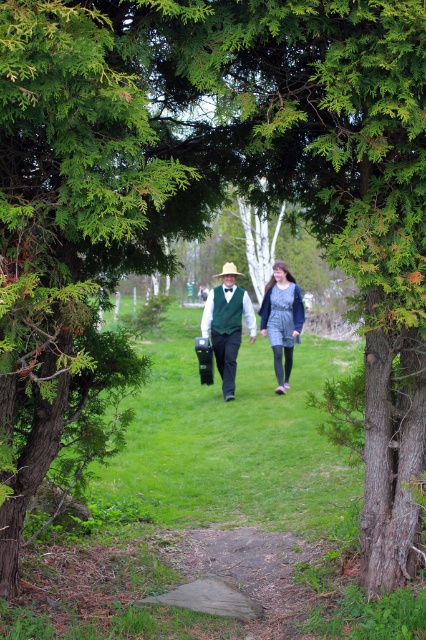
Does green textured tree at center have a lesser width compared to denim dress at center?

In fact, green textured tree at center might be wider than denim dress at center.

Is point (83, 154) more distant than point (270, 310)?

No, it is in front of (270, 310).

Find the location of `green textured tree at center`. green textured tree at center is located at coordinates (66, 218).

Measure the distance between green textured tree at center and matte green vest at center.

The distance of green textured tree at center from matte green vest at center is 24.93 feet.

Image resolution: width=426 pixels, height=640 pixels. Describe the element at coordinates (66, 218) in the screenshot. I see `green textured tree at center` at that location.

Is point (69, 376) positioned after point (229, 305)?

That is False.

You are a GUI agent. You are given a task and a screenshot of the screen. Output one action in this format:
    pyautogui.click(x=<x>, y=<y>)
    Task: Click on the green textured tree at center
    This screenshot has height=640, width=426.
    Given the screenshot: What is the action you would take?
    pyautogui.click(x=66, y=218)

Measure the distance between matte green vest at center and denim dress at center.

They are 5.50 inches apart.

Does matte green vest at center lie in front of denim dress at center?

Yes, matte green vest at center is in front of denim dress at center.

What do you see at coordinates (227, 324) in the screenshot? This screenshot has height=640, width=426. I see `matte green vest at center` at bounding box center [227, 324].

At what (x,y) coordinates should I click in order to perform the action: click on matte green vest at center. Please return your answer as a coordinate pair (x, y). The image size is (426, 640). Looking at the image, I should click on (227, 324).